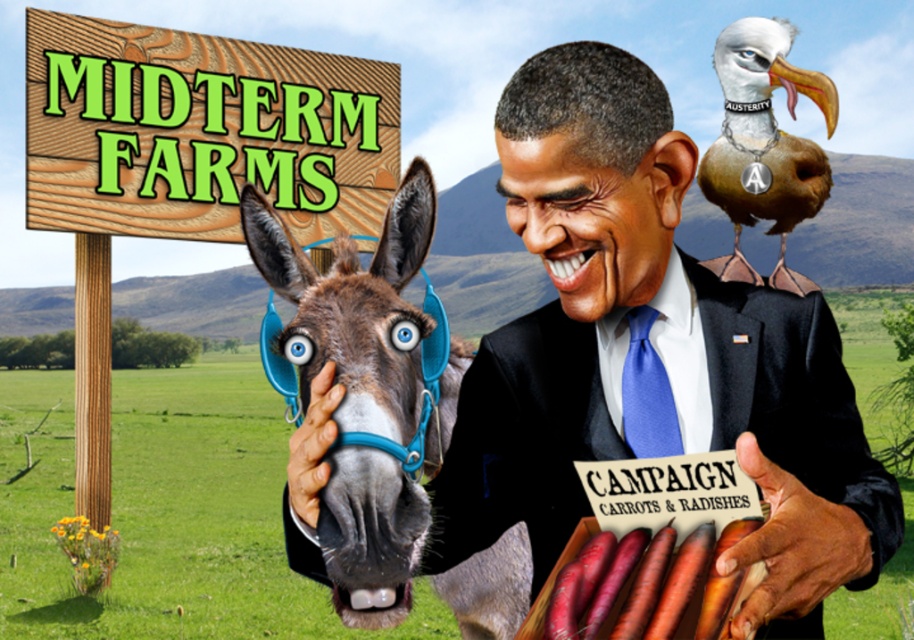
Question: Estimate the real-world distances between objects in this image. Which object is farther from the brown leather donkey at left?

Choices:
 (A) deep orange carrot at lower center
 (B) wooden signboard at upper left
 (C) black satin business suit at center
 (D) brown feathered bird at upper right

Answer: (B)

Question: Does black satin business suit at center appear under brown feathered bird at upper right?

Choices:
 (A) no
 (B) yes

Answer: (B)

Question: Does wooden signboard at upper left appear under black satin business suit at center?

Choices:
 (A) yes
 (B) no

Answer: (B)

Question: Among these objects, which one is nearest to the camera?

Choices:
 (A) wooden signboard at upper left
 (B) deep orange carrot at lower center
 (C) black satin business suit at center
 (D) brown leather donkey at left

Answer: (B)

Question: Does brown feathered bird at upper right appear under deep orange carrot at lower center?

Choices:
 (A) yes
 (B) no

Answer: (B)

Question: Which object is closer to the camera taking this photo?

Choices:
 (A) deep orange carrot at lower center
 (B) brown leather donkey at left
 (C) wooden signboard at upper left
 (D) black satin business suit at center

Answer: (A)